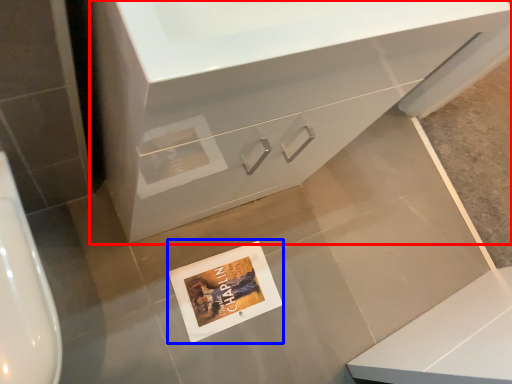
Question: Which object is further to the camera taking this photo, bathroom cabinet (highlighted by a red box) or postcard (highlighted by a blue box)?

Choices:
 (A) bathroom cabinet
 (B) postcard

Answer: (B)